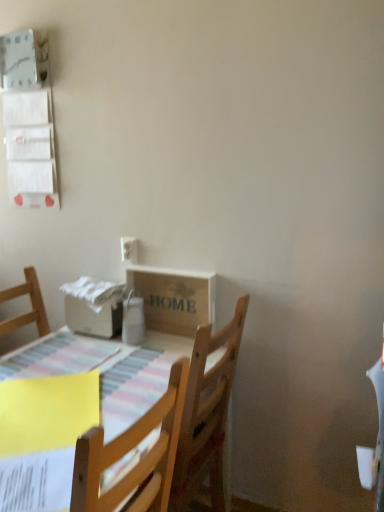
Question: Does white plastic electric outlet at upper left appear on the left side of wooden table at lower left?

Choices:
 (A) yes
 (B) no

Answer: (B)

Question: Does white plastic electric outlet at upper left have a lesser width compared to wooden table at lower left?

Choices:
 (A) no
 (B) yes

Answer: (B)

Question: Considering the relative sizes of white plastic electric outlet at upper left and wooden table at lower left in the image provided, is white plastic electric outlet at upper left bigger than wooden table at lower left?

Choices:
 (A) yes
 (B) no

Answer: (B)

Question: Does white plastic electric outlet at upper left have a smaller size compared to wooden table at lower left?

Choices:
 (A) no
 (B) yes

Answer: (B)

Question: Is white plastic electric outlet at upper left behind wooden table at lower left?

Choices:
 (A) yes
 (B) no

Answer: (A)

Question: Would you say wooden table at lower left is to the left or to the right of wooden crate at center in the picture?

Choices:
 (A) left
 (B) right

Answer: (A)

Question: From their relative heights in the image, would you say wooden table at lower left is taller or shorter than wooden crate at center?

Choices:
 (A) tall
 (B) short

Answer: (A)

Question: Choose the correct answer: Is wooden table at lower left inside wooden crate at center or outside it?

Choices:
 (A) inside
 (B) outside

Answer: (B)

Question: From a real-world perspective, relative to wooden crate at center, is wooden table at lower left vertically above or below?

Choices:
 (A) below
 (B) above

Answer: (A)

Question: In terms of width, does wooden crate at center look wider or thinner when compared to white plastic electric outlet at upper left?

Choices:
 (A) thin
 (B) wide

Answer: (B)

Question: Is wooden crate at center inside the boundaries of white plastic electric outlet at upper left, or outside?

Choices:
 (A) inside
 (B) outside

Answer: (B)

Question: From their relative heights in the image, would you say wooden crate at center is taller or shorter than white plastic electric outlet at upper left?

Choices:
 (A) tall
 (B) short

Answer: (A)

Question: In the image, is wooden crate at center on the left side or the right side of white plastic electric outlet at upper left?

Choices:
 (A) left
 (B) right

Answer: (B)

Question: Based on their sizes in the image, would you say white plastic electric outlet at upper left is bigger or smaller than wooden table at lower left?

Choices:
 (A) big
 (B) small

Answer: (B)

Question: Looking at their shapes, would you say white plastic electric outlet at upper left is wider or thinner than wooden table at lower left?

Choices:
 (A) thin
 (B) wide

Answer: (A)